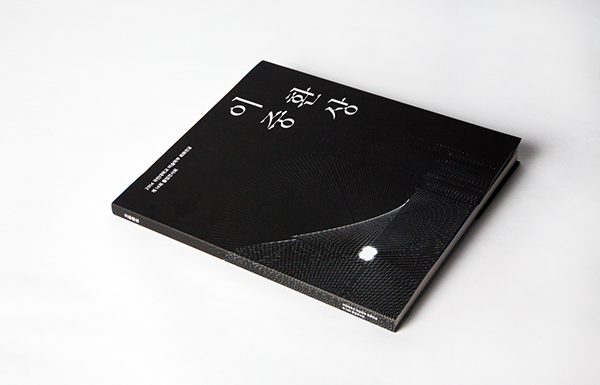
Where is `spine of book`? The image size is (600, 385). spine of book is located at coordinates (205, 246).